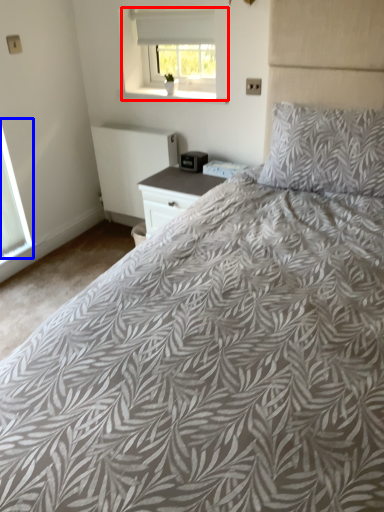
Question: Which of the following is the closest to the observer, window (highlighted by a red box) or window (highlighted by a blue box)?

Choices:
 (A) window
 (B) window

Answer: (B)